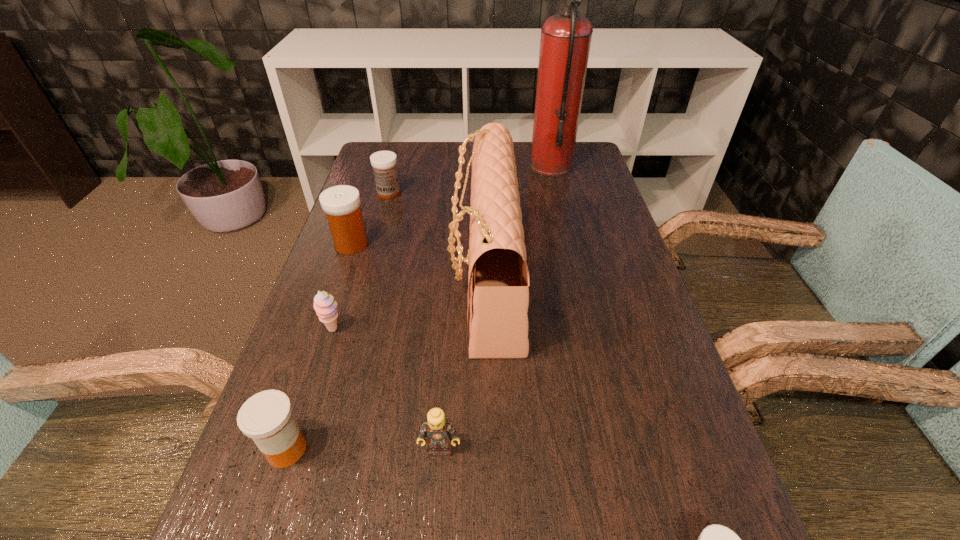
Find the location of a particular element. The height and width of the screenshot is (540, 960). free space located on the front of the sherbert is located at coordinates (318, 379).

In order to click on vacant area situated 0.120m in front of the Lego in this screenshot , I will do `click(434, 537)`.

Where is `object that is positioned at the far edge`? The width and height of the screenshot is (960, 540). object that is positioned at the far edge is located at coordinates (565, 41).

Find the location of a particular element. The height and width of the screenshot is (540, 960). sherbert at the left edge is located at coordinates (325, 306).

The height and width of the screenshot is (540, 960). What are the coordinates of `object present at the right edge` in the screenshot? It's located at (565, 41).

Where is `object that is at the far right corner`? object that is at the far right corner is located at coordinates (565, 41).

In the image, there is a desktop. Where is `free space at the far edge`? This screenshot has height=540, width=960. free space at the far edge is located at coordinates (465, 156).

The width and height of the screenshot is (960, 540). Find the location of `vacant space at the left edge of the desktop`. vacant space at the left edge of the desktop is located at coordinates (334, 400).

What are the coordinates of `vacant space at the right edge of the desktop` in the screenshot? It's located at (704, 488).

Identify the location of free space at the far left corner of the desktop. (393, 144).